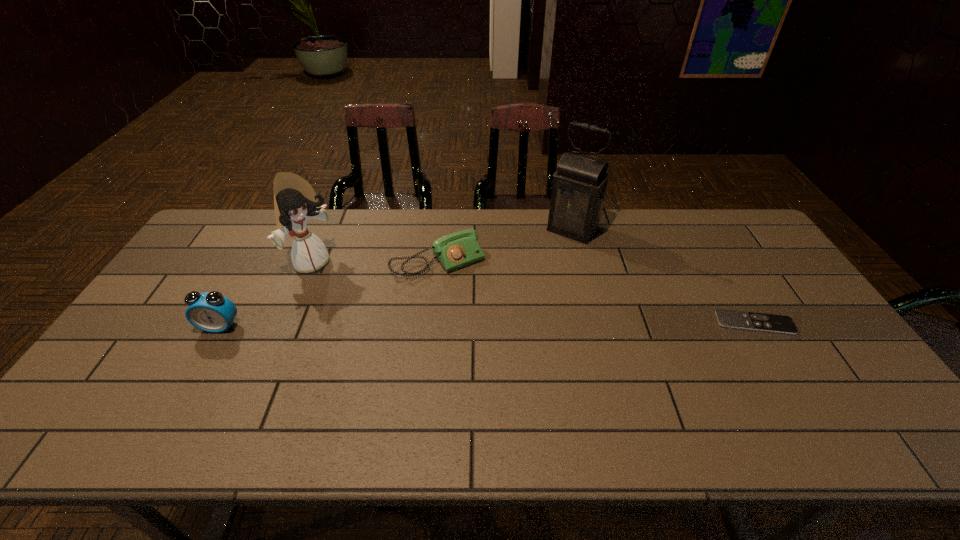
The width and height of the screenshot is (960, 540). I want to click on free space on the desktop that is between the alarm clock and the rightmost object and is positioned on the front-facing side of the lantern, so click(500, 325).

Where is `free spot on the desktop that is between the third shortest object and the rightmost object and is positioned on the dial of the telephone`? Image resolution: width=960 pixels, height=540 pixels. free spot on the desktop that is between the third shortest object and the rightmost object and is positioned on the dial of the telephone is located at coordinates (485, 325).

Identify the location of free space on the desktop that is between the third tallest object and the rightmost object and is positioned at the front face of the second tallest object. (416, 325).